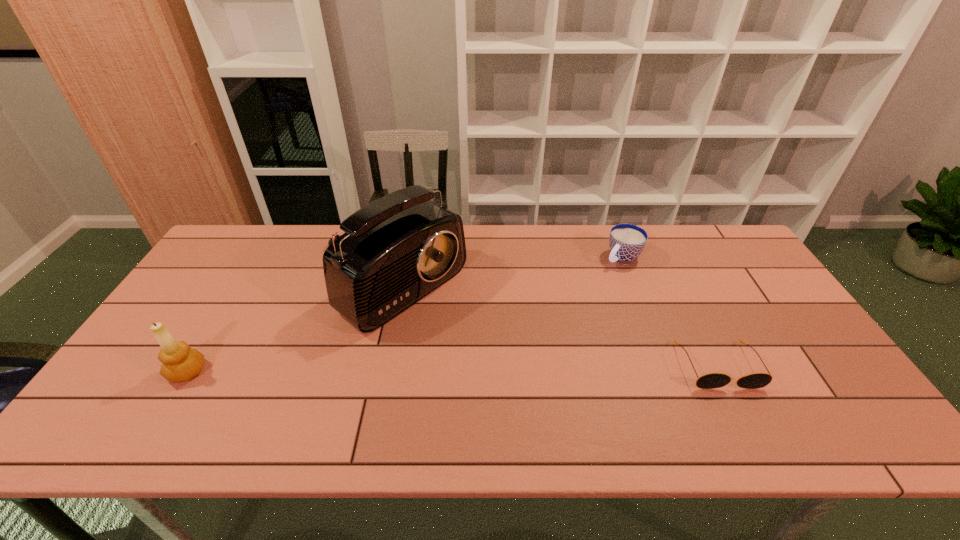
Identify the location of vacant space on the desktop that is between the candle_holder and the shortest object and is positioned on the side of the cup with the handle. This screenshot has height=540, width=960. (492, 368).

At what (x,y) coordinates should I click in order to perform the action: click on vacant space on the desktop that is between the candle_holder and the shortest object and is positioned on the front-facing side of the radio receiver. Please return your answer as a coordinate pair (x, y). The height and width of the screenshot is (540, 960). Looking at the image, I should click on (511, 368).